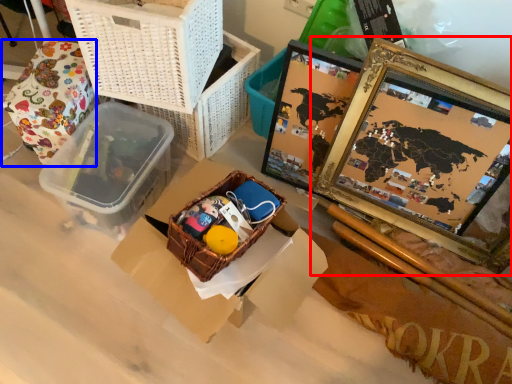
Question: Among these objects, which one is nearest to the camera, picture frame (highlighted by a red box) or wrapping paper (highlighted by a blue box)?

Choices:
 (A) picture frame
 (B) wrapping paper

Answer: (A)